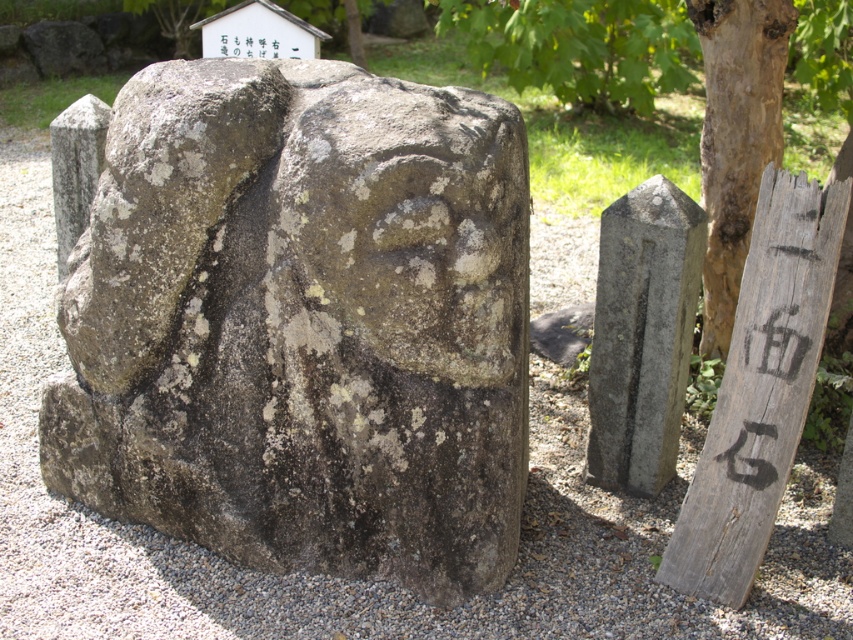
Question: Estimate the real-world distances between objects in this image. Which object is closer to the rusty stone statue at center?

Choices:
 (A) brown rough bark tree at right
 (B) rough stone face at center
 (C) black painted wood at right

Answer: (B)

Question: Which point is farther from the camera taking this photo?

Choices:
 (A) (335, 156)
 (B) (712, 305)
 (C) (518, 454)

Answer: (B)

Question: Among these objects, which one is farthest from the camera?

Choices:
 (A) gray stone marker at right
 (B) rusty stone statue at center
 (C) black painted wood at right

Answer: (A)

Question: Is gray stone marker at right smaller than black painted wood at right?

Choices:
 (A) yes
 (B) no

Answer: (B)

Question: Is the position of rough stone face at center less distant than that of black painted wood at right?

Choices:
 (A) no
 (B) yes

Answer: (B)

Question: Is gray stone marker at right below black painted wood at right?

Choices:
 (A) yes
 (B) no

Answer: (B)